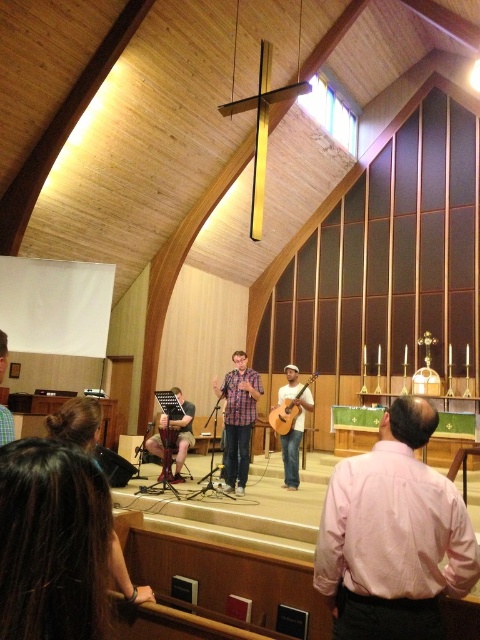
You are standing at the entrance of the church and want to see the matte white guitar at center. Based on its coordinates, is it closer to the front or the back of the church?

The matte white guitar at center is located at coordinates point (291, 420), which places it closer to the back of the church since the coordinates are closer to 1 on both axes, indicating proximity to the rear.

You are a musician who wants to play both guitars. You see the matte white guitar at center and the acoustic wood guitar at center. Which one is positioned higher in the image?

The acoustic wood guitar at center is positioned higher because the matte white guitar at center is located below it.